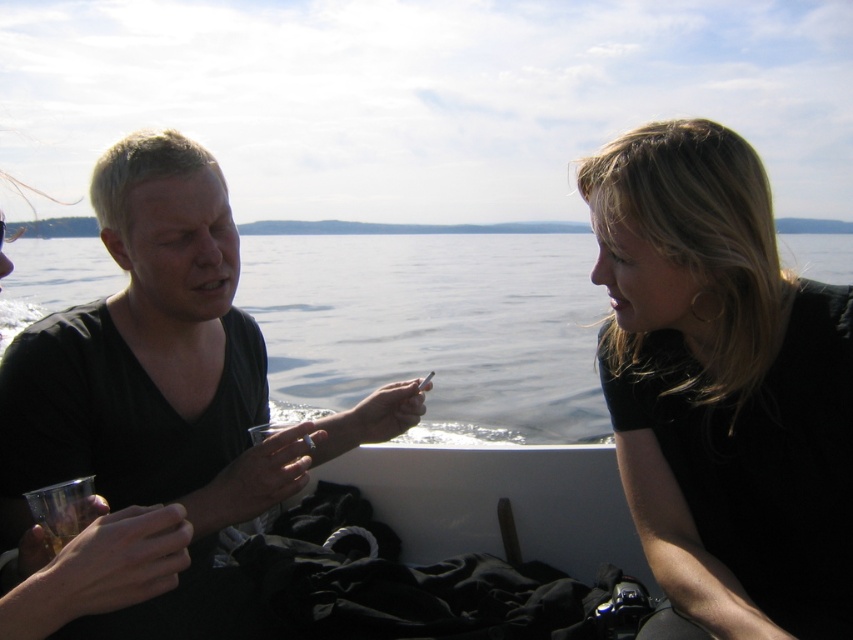
You are designing a poster for a travel agency and need to highlight the two elements from the scene. Which element has a smaller width between the black matte hair at upper right and the black matte shirt at left?

The black matte hair at upper right has a smaller width compared to the black matte shirt at left.

You are a photographer trying to capture the black matte hair at upper right. The camera you are using has a focal point at point (723,387). Will the black matte hair at upper right be in focus?

The black matte hair at upper right is represented by point (723,387), so yes, the black matte hair at upper right will be in focus since the focal point is exactly at that coordinate.

You are navigating a small boat and need to drop an anchor at point A, which is at coordinates point (718, 445), and point B at point (109, 381). Which point should you reach first if you want to anchor closer to the person on the right?

Point (718, 445) is in front of point (109, 381), so you should anchor at point (718, 445) first to be closer to the person on the right.